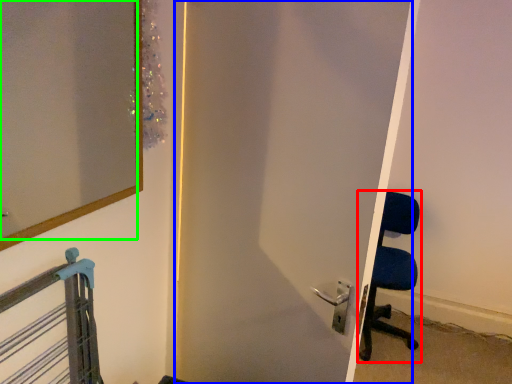
Question: Estimate the real-world distances between objects in this image. Which object is closer to chair (highlighted by a red box), door (highlighted by a blue box) or mirror (highlighted by a green box)?

Choices:
 (A) door
 (B) mirror

Answer: (A)